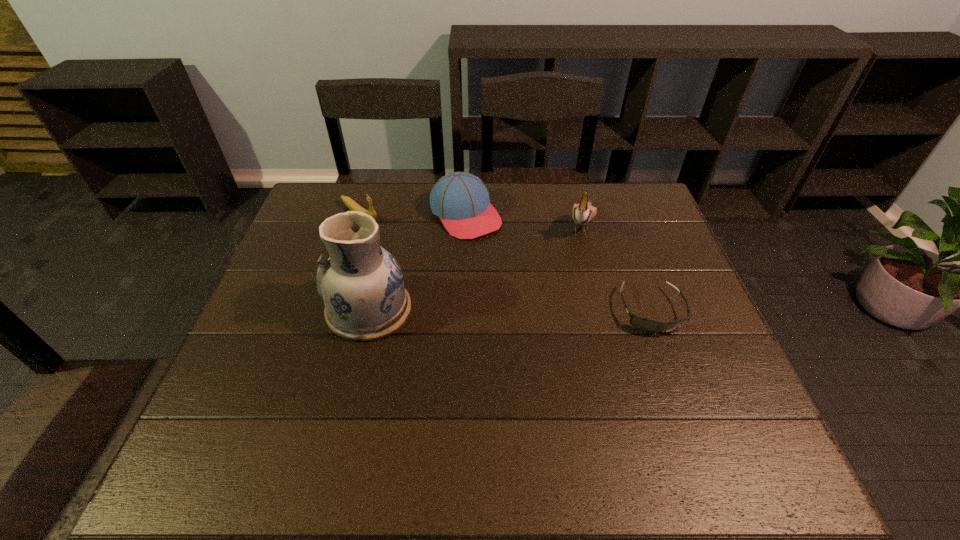
Find the location of a particular element. The height and width of the screenshot is (540, 960). object situated at the right edge is located at coordinates (646, 325).

Find the location of a particular element. object that is at the far left corner is located at coordinates (350, 203).

Locate an element on the screen. vacant area at the far edge is located at coordinates (514, 187).

The height and width of the screenshot is (540, 960). I want to click on free space at the left edge of the desktop, so click(228, 364).

The image size is (960, 540). Identify the location of vacant space at the right edge of the desktop. (652, 341).

In the image, there is a desktop. Identify the location of free space at the far left corner. Image resolution: width=960 pixels, height=540 pixels. (352, 198).

Locate an element on the screen. vacant space at the far right corner of the desktop is located at coordinates (650, 197).

Locate an element on the screen. Image resolution: width=960 pixels, height=540 pixels. free space at the near right corner is located at coordinates (695, 390).

This screenshot has width=960, height=540. Find the location of `empty location between the tallest object and the goggles`. empty location between the tallest object and the goggles is located at coordinates (510, 310).

At what (x,y) coordinates should I click in order to perform the action: click on empty location between the banana and the baseball cap. Please return your answer as a coordinate pair (x, y). The image size is (960, 540). Looking at the image, I should click on (413, 214).